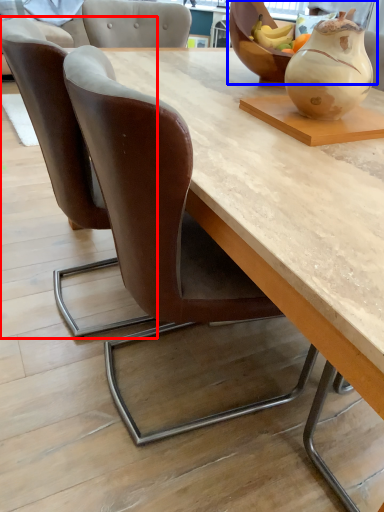
Question: Among these objects, which one is nearest to the camera, chair (highlighted by a red box) or bowl (highlighted by a blue box)?

Choices:
 (A) chair
 (B) bowl

Answer: (A)